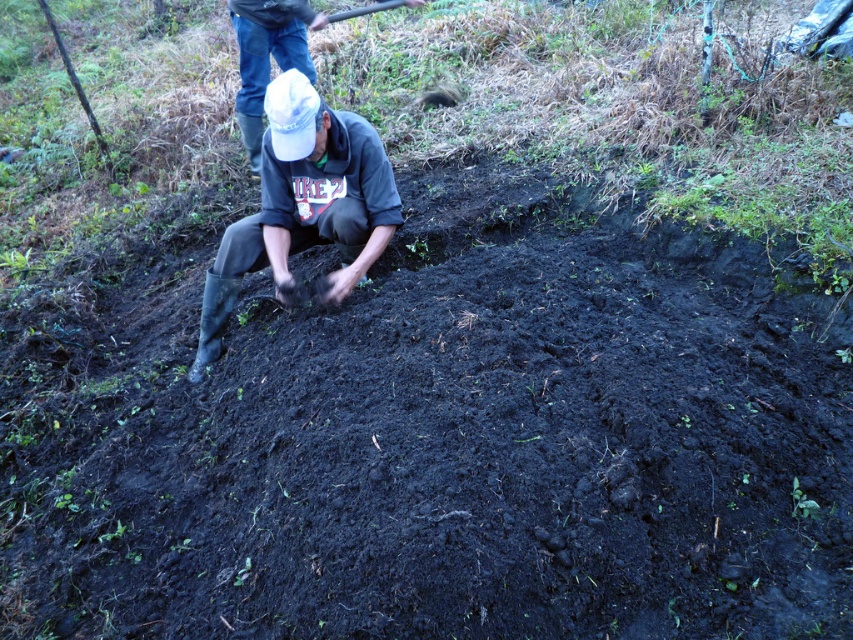
Does rubber boots at center have a larger size compared to denim jeans at upper center?

Yes.

Who is taller, rubber boots at center or denim jeans at upper center?

rubber boots at center is taller.

Where is `rubber boots at center`? rubber boots at center is located at coordinates (303, 205).

What are the coordinates of `rubber boots at center` in the screenshot? It's located at (303, 205).